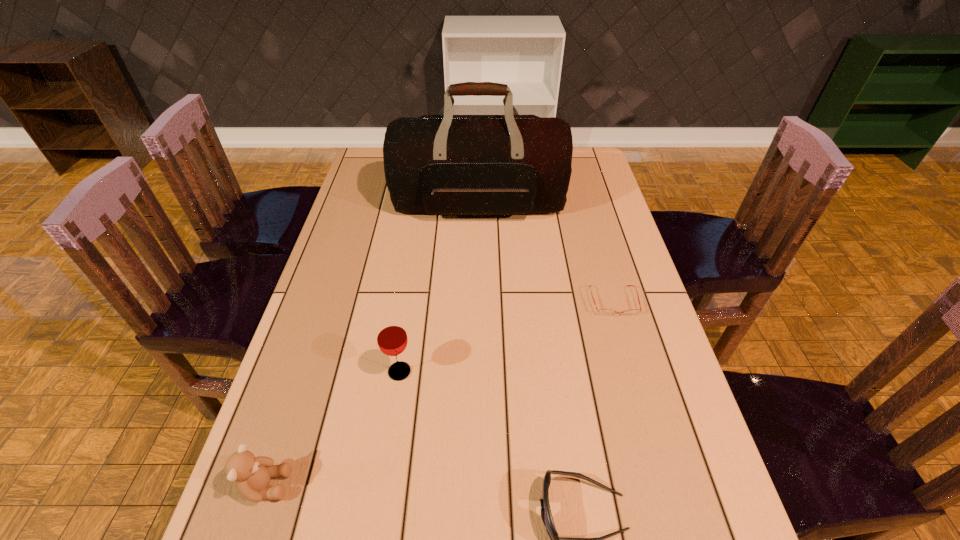
I want to click on vacant area that lies between the third tallest object and the glass, so click(333, 428).

I want to click on vacant area between the duffel bag and the third shortest object, so click(x=372, y=345).

Identify the location of empty location between the third farthest object and the farthest object. This screenshot has width=960, height=540. (440, 288).

Locate an element on the screen. The width and height of the screenshot is (960, 540). empty space that is in between the glass and the fourth nearest object is located at coordinates (507, 336).

You are a GUI agent. You are given a task and a screenshot of the screen. Output one action in this format:
    pyautogui.click(x=<x>, y=<y>)
    Task: Click on the object that stands as the fourth closest to the farthest object
    Image resolution: width=960 pixels, height=540 pixels.
    Given the screenshot: What is the action you would take?
    [x=546, y=515]

Locate an element on the screen. The height and width of the screenshot is (540, 960). object that ranks as the closest to the third tallest object is located at coordinates (392, 340).

Find the location of a particular element. Image resolution: width=960 pixels, height=540 pixels. free location that satisfies the following two spatial constraints: 1. on the lenses of the shortest object; 2. on the face of the third shortest object is located at coordinates (666, 485).